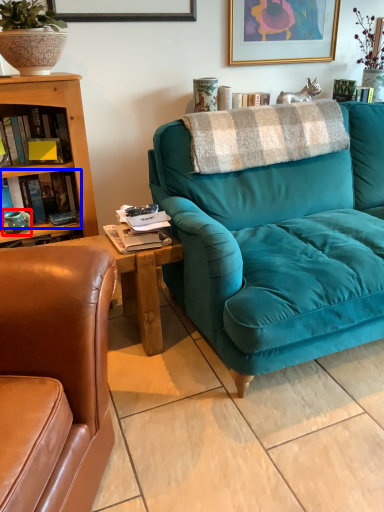
Question: Among these objects, which one is nearest to the camera, teal (highlighted by a red box) or book (highlighted by a blue box)?

Choices:
 (A) teal
 (B) book

Answer: (B)